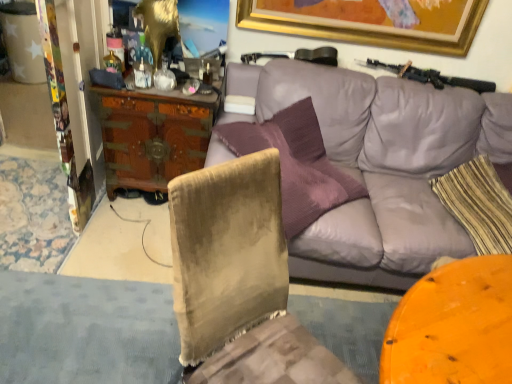
I want to click on vacant area that lies in front of wooden carved desk at center left, so click(126, 237).